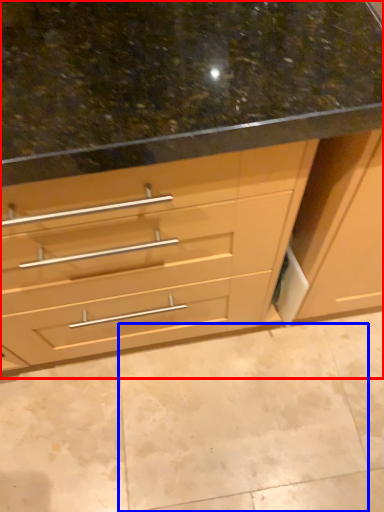
Question: Among these objects, which one is nearest to the camera, cabinetry (highlighted by a red box) or granite (highlighted by a blue box)?

Choices:
 (A) cabinetry
 (B) granite

Answer: (A)